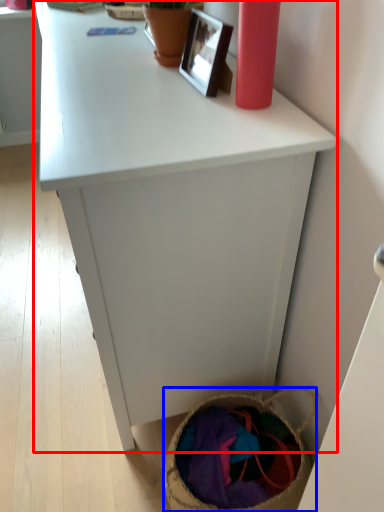
Question: Which of the following is the closest to the observer, desk (highlighted by a red box) or basket (highlighted by a blue box)?

Choices:
 (A) desk
 (B) basket

Answer: (A)